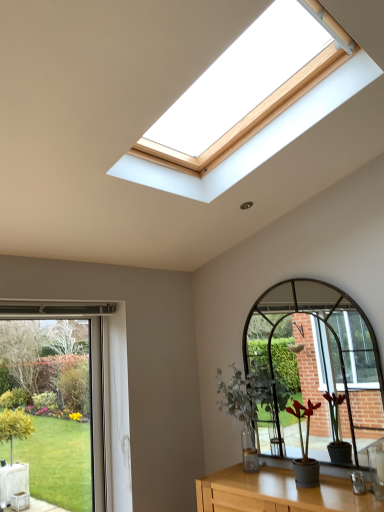
Question: Can you see green matte plant at center, marked as the 2th houseplant in a front-to-back arrangement, touching green glass window at lower left?

Choices:
 (A) no
 (B) yes

Answer: (A)

Question: Considering the relative sizes of green matte plant at center, marked as the 2th houseplant in a front-to-back arrangement, and green glass window at lower left in the image provided, is green matte plant at center, marked as the 2th houseplant in a front-to-back arrangement, shorter than green glass window at lower left?

Choices:
 (A) no
 (B) yes

Answer: (B)

Question: Does green matte plant at center, which is the 2th houseplant from right to left, have a larger size compared to green glass window at lower left?

Choices:
 (A) no
 (B) yes

Answer: (B)

Question: Is green matte plant at center, which is the 2th houseplant from right to left, to the right of green glass window at lower left from the viewer's perspective?

Choices:
 (A) no
 (B) yes

Answer: (B)

Question: Is green matte plant at center, which appears as the 1th houseplant when viewed from the left, positioned with its back to green glass window at lower left?

Choices:
 (A) yes
 (B) no

Answer: (B)

Question: Looking at their shapes, would you say green glass window at lower left is wider or thinner than green matte plant at center, which is the 2th houseplant from right to left?

Choices:
 (A) thin
 (B) wide

Answer: (A)

Question: Does point (61, 423) appear closer or farther from the camera than point (233, 377)?

Choices:
 (A) closer
 (B) farther

Answer: (B)

Question: Is green glass window at lower left spatially inside green matte plant at center, marked as the 2th houseplant in a front-to-back arrangement, or outside of it?

Choices:
 (A) inside
 (B) outside

Answer: (B)

Question: From their relative heights in the image, would you say green glass window at lower left is taller or shorter than green matte plant at center, which ranks as the first houseplant in back-to-front order?

Choices:
 (A) tall
 (B) short

Answer: (A)

Question: Considering the positions of green matte plant at center, marked as the 2th houseplant in a front-to-back arrangement, and green matte plant at center, which is counted as the 1th houseplant, starting from the right, in the image, is green matte plant at center, marked as the 2th houseplant in a front-to-back arrangement, taller or shorter than green matte plant at center, which is counted as the 1th houseplant, starting from the right,?

Choices:
 (A) tall
 (B) short

Answer: (A)

Question: Based on their sizes in the image, would you say green matte plant at center, marked as the 2th houseplant in a front-to-back arrangement, is bigger or smaller than green matte plant at center, the second houseplant positioned from the back?

Choices:
 (A) small
 (B) big

Answer: (B)

Question: Is green matte plant at center, which is the 2th houseplant from right to left, wider or thinner than green matte plant at center, which is the first houseplant in front-to-back order?

Choices:
 (A) thin
 (B) wide

Answer: (B)

Question: Is green matte plant at center, which is the 2th houseplant from right to left, to the left or to the right of green matte plant at center, which is counted as the 1th houseplant, starting from the right, in the image?

Choices:
 (A) left
 (B) right

Answer: (A)

Question: Considering their positions, is green glass window at lower left located in front of or behind green matte plant at center, the 2th houseplant in the left-to-right sequence?

Choices:
 (A) front
 (B) behind

Answer: (B)

Question: Looking at their shapes, would you say green glass window at lower left is wider or thinner than green matte plant at center, which is the first houseplant in front-to-back order?

Choices:
 (A) thin
 (B) wide

Answer: (A)